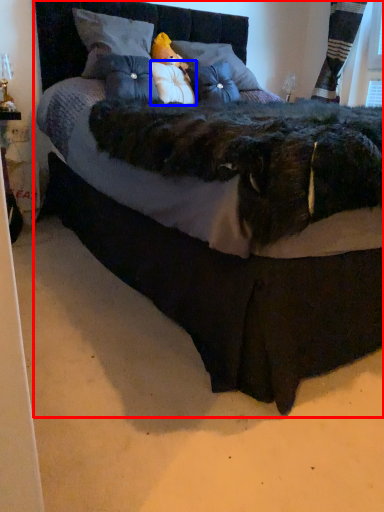
Question: Among these objects, which one is nearest to the camera, bed (highlighted by a red box) or pillow (highlighted by a blue box)?

Choices:
 (A) bed
 (B) pillow

Answer: (A)